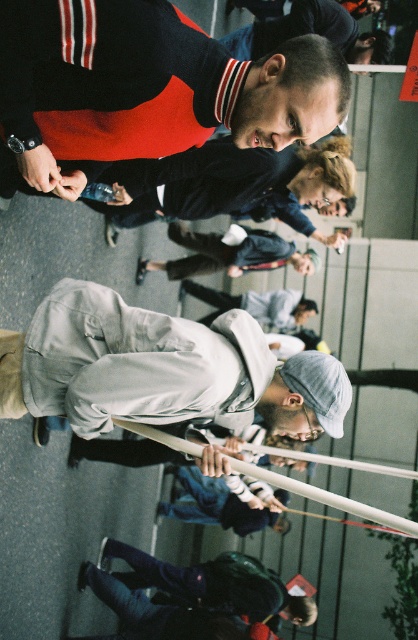
You are standing at the top of a staircase overlooking a gathering. You notice two people wearing a matte black sweater at upper center and a dark blue sweater at upper center. Which person is positioned lower in the scene?

The matte black sweater at upper center is located below the dark blue sweater at upper center, so the person wearing the matte black sweater at upper center is positioned lower in the scene.

You are standing at the point labeled point (147, 88) in the image. Looking around, you notice a matte black sweater at upper center. Which direction should you face to see the matte black sweater at upper center?

The point labeled point (147, 88) is on the matte black sweater at upper center, so facing forward would allow you to see the matte black sweater at upper center.